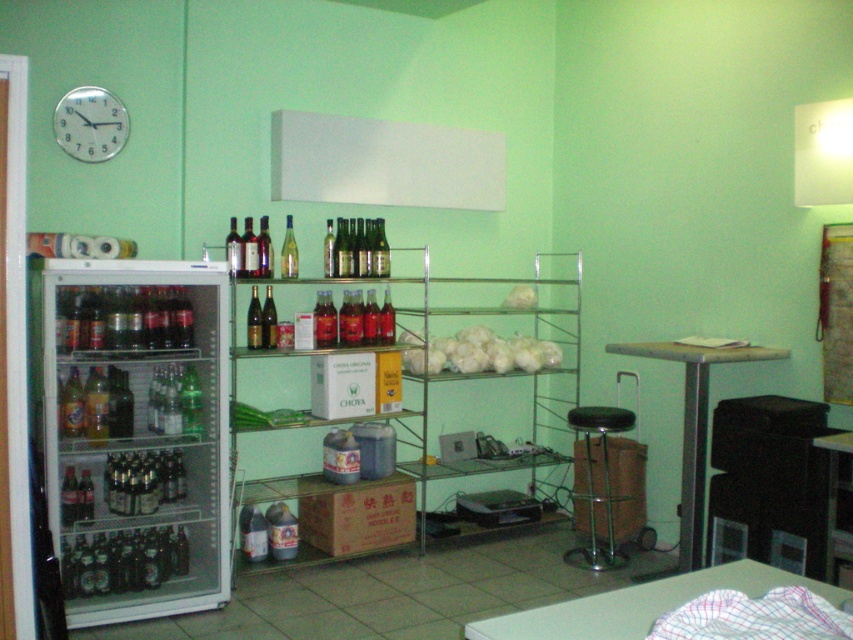
Between brown cardboard box at center and translucent glass bottle at lower left, which one appears on the left side from the viewer's perspective?

From the viewer's perspective, translucent glass bottle at lower left appears more on the left side.

Which is in front, point (369, 504) or point (165, 461)?

Point (165, 461)

Locate an element on the screen. This screenshot has height=640, width=853. brown cardboard box at center is located at coordinates (341, 513).

Does point (122, 502) come closer to viewer compared to point (262, 321)?

That is True.

Does translucent glass bottle at lower left appear on the right side of green glass wine at center?

In fact, translucent glass bottle at lower left is to the left of green glass wine at center.

Where is `translucent glass bottle at lower left`? translucent glass bottle at lower left is located at coordinates (143, 481).

Between green glass bottles at left and silver metallic clock at upper left, which one has more height?

With more height is silver metallic clock at upper left.

Does green glass bottles at left appear on the right side of silver metallic clock at upper left?

Indeed, green glass bottles at left is positioned on the right side of silver metallic clock at upper left.

Locate an element on the screen. green glass bottles at left is located at coordinates (141, 406).